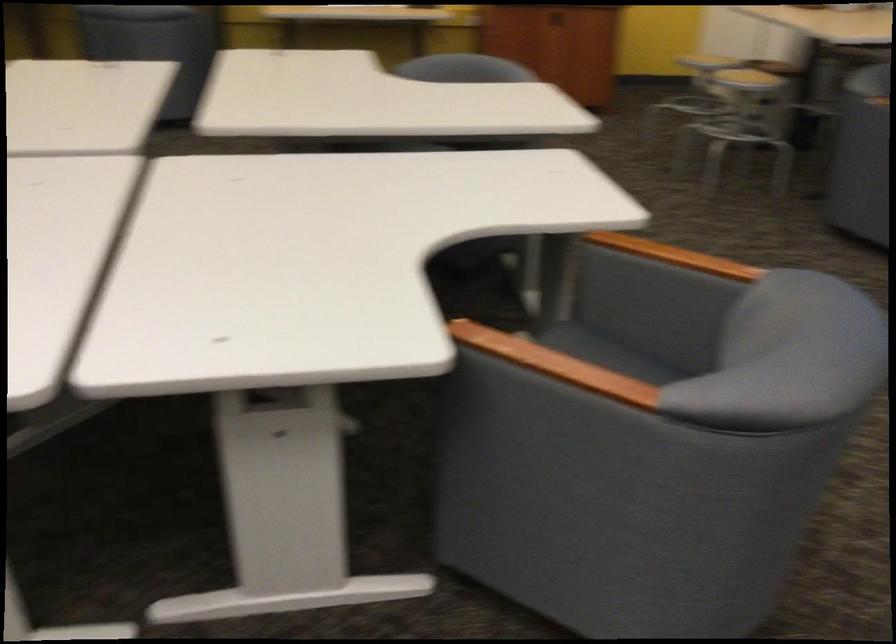
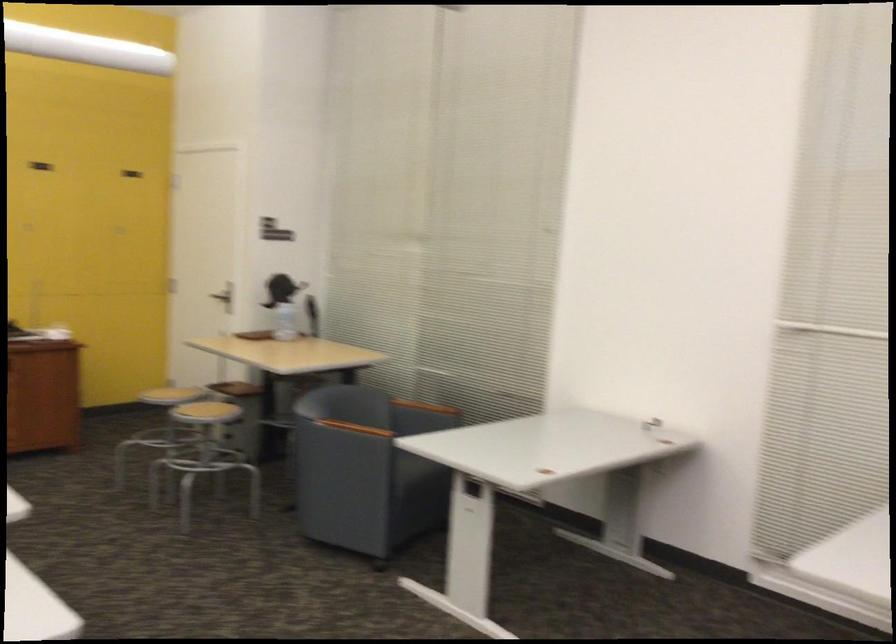
How did the camera likely rotate?

The rotation direction of the camera is right-up.